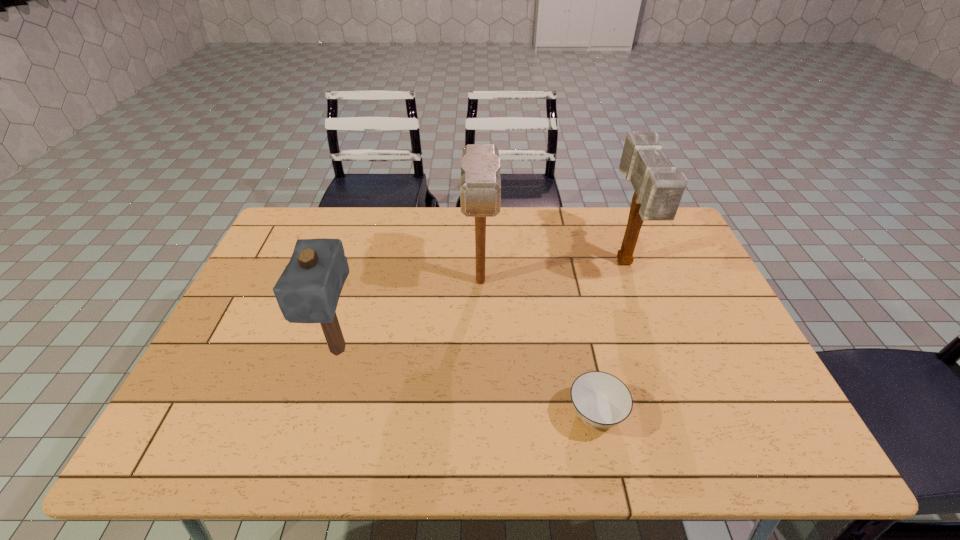
Image resolution: width=960 pixels, height=540 pixels. I want to click on free point that satisfies the following two spatial constraints: 1. on the front side of the nearest object; 2. on the right side of the second nearest object, so (320, 414).